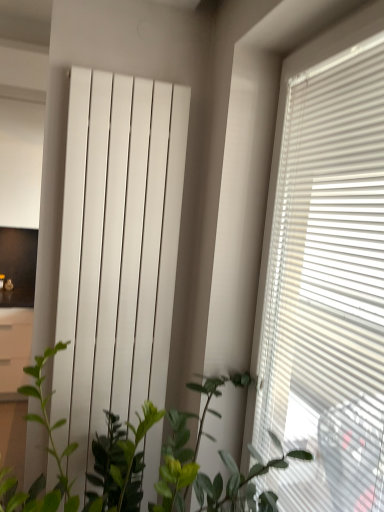
Question: Can you confirm if white glossy radiator at center is taller than white glossy file cabinet at left?

Choices:
 (A) yes
 (B) no

Answer: (A)

Question: Is white glossy radiator at center with white glossy file cabinet at left?

Choices:
 (A) yes
 (B) no

Answer: (B)

Question: Is white glossy radiator at center looking in the opposite direction of white glossy file cabinet at left?

Choices:
 (A) no
 (B) yes

Answer: (B)

Question: Can you confirm if white glossy radiator at center is bigger than white glossy file cabinet at left?

Choices:
 (A) yes
 (B) no

Answer: (B)

Question: Does white glossy radiator at center have a lesser height compared to white glossy file cabinet at left?

Choices:
 (A) yes
 (B) no

Answer: (B)

Question: In terms of height, does white matte window blind at right look taller or shorter compared to white glossy radiator at center?

Choices:
 (A) tall
 (B) short

Answer: (B)

Question: From the image's perspective, is white matte window blind at right above or below white glossy radiator at center?

Choices:
 (A) above
 (B) below

Answer: (B)

Question: Does point (337, 178) appear closer or farther from the camera than point (132, 119)?

Choices:
 (A) closer
 (B) farther

Answer: (A)

Question: Is white matte window blind at right bigger or smaller than white glossy radiator at center?

Choices:
 (A) small
 (B) big

Answer: (B)

Question: Is point (16, 372) closer or farther from the camera than point (61, 460)?

Choices:
 (A) farther
 (B) closer

Answer: (A)

Question: In the image, is white glossy file cabinet at left positioned in front of or behind green leafy plant at center?

Choices:
 (A) behind
 (B) front

Answer: (A)

Question: From a real-world perspective, is white glossy file cabinet at left above or below green leafy plant at center?

Choices:
 (A) below
 (B) above

Answer: (A)

Question: Looking at the image, does white glossy file cabinet at left seem bigger or smaller compared to green leafy plant at center?

Choices:
 (A) big
 (B) small

Answer: (B)

Question: From the image's perspective, relative to white matte window blind at right, is white glossy radiator at center above or below?

Choices:
 (A) above
 (B) below

Answer: (A)

Question: Do you think white glossy radiator at center is within white matte window blind at right, or outside of it?

Choices:
 (A) outside
 (B) inside

Answer: (A)